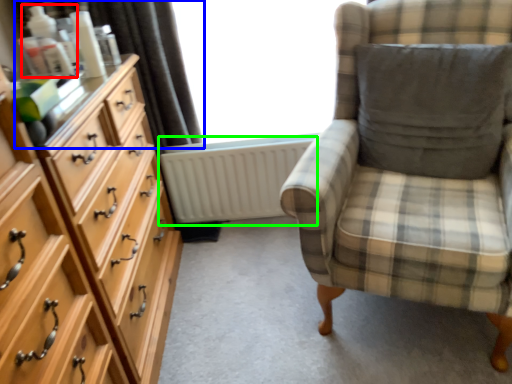
Question: Based on their relative distances, which object is nearer to toiletry (highlighted by a red box)? Choose from curtain (highlighted by a blue box) and radiator (highlighted by a green box).

Choices:
 (A) curtain
 (B) radiator

Answer: (A)